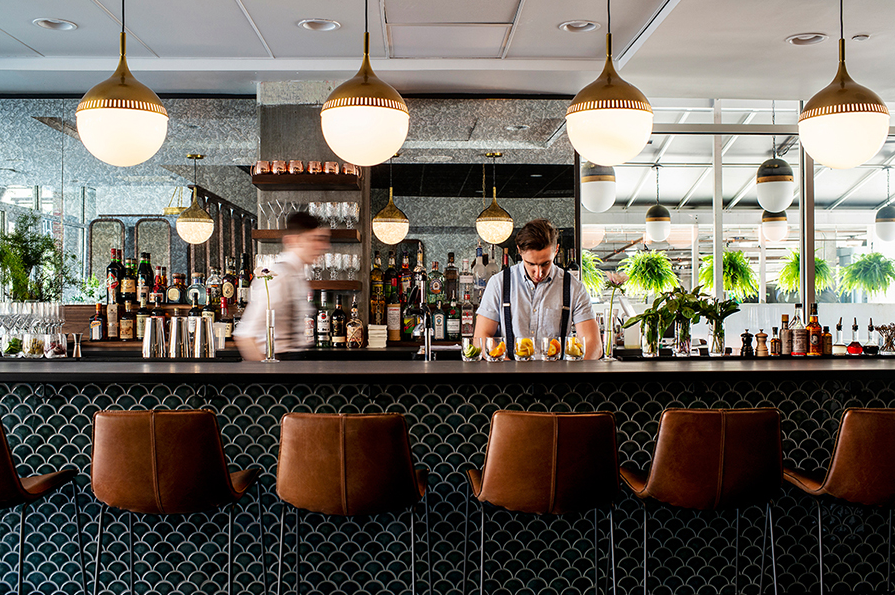
The height and width of the screenshot is (595, 895). Find the location of `black and gray counter`. black and gray counter is located at coordinates (256, 403).